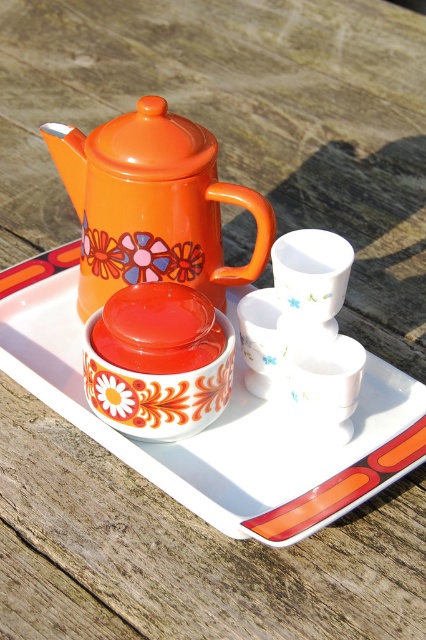
Is point (245, 500) less distant than point (273, 221)?

Yes, it is.

Is orange glossy saucer at center thinner than orange glossy teapot at upper left?

In fact, orange glossy saucer at center might be wider than orange glossy teapot at upper left.

Between point (39, 272) and point (187, 131), which one is positioned in front?

Point (187, 131) is more forward.

I want to click on orange glossy saucer at center, so click(216, 420).